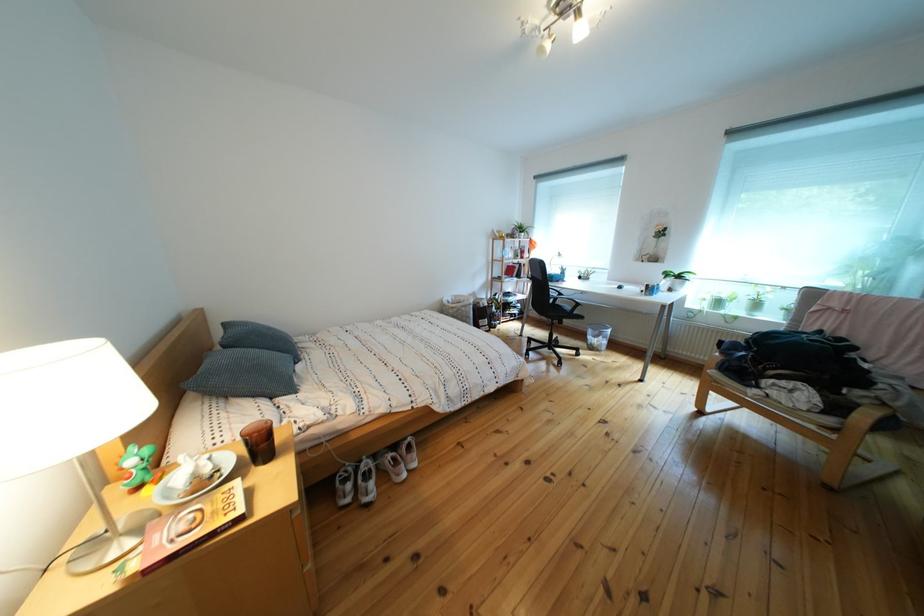
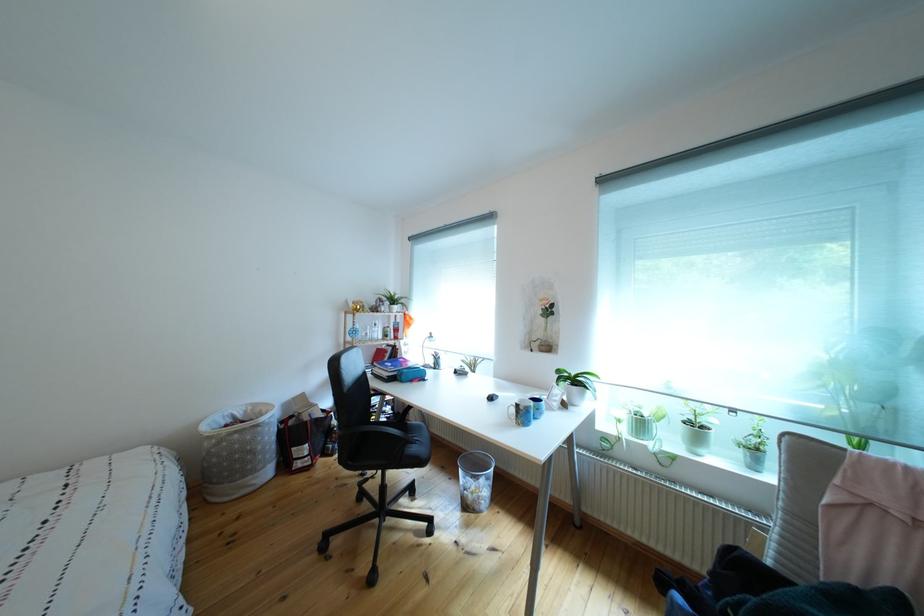
Question: I am providing you with two images of the same scene from different viewpoints. Please identify which objects are invisible in image2.

Choices:
 (A) blue patterned mug
 (B) black computer mouse
 (C) clear glass bottle
 (D) none of these

Answer: (D)